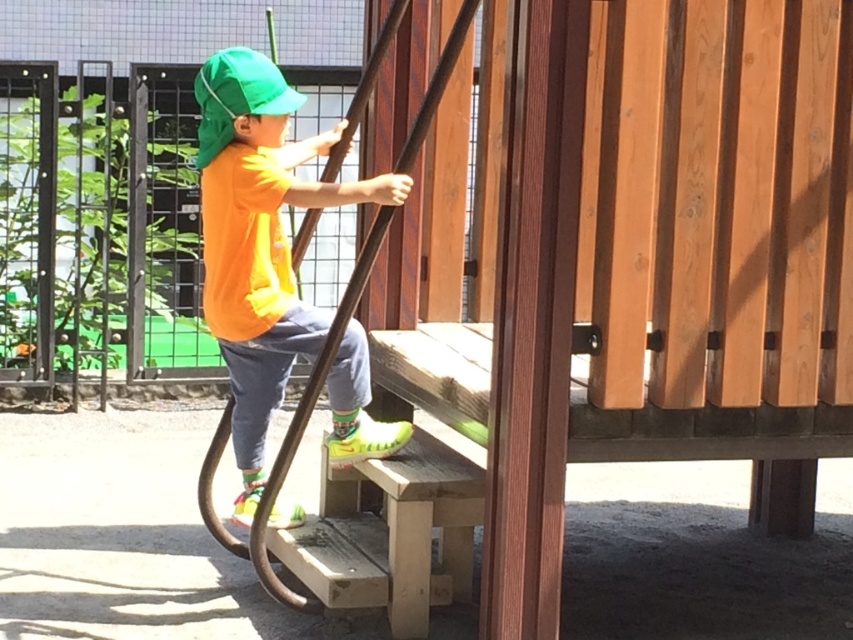
Based on the photo, who is more forward, [292,92] or [267,96]?

Positioned in front is point [267,96].

Who is higher up, matte orange shirt at center or green fabric cap at upper left?

green fabric cap at upper left is above.

What do you see at coordinates (260, 240) in the screenshot? This screenshot has width=853, height=640. I see `matte orange shirt at center` at bounding box center [260, 240].

What are the coordinates of `matte orange shirt at center` in the screenshot? It's located at (260, 240).